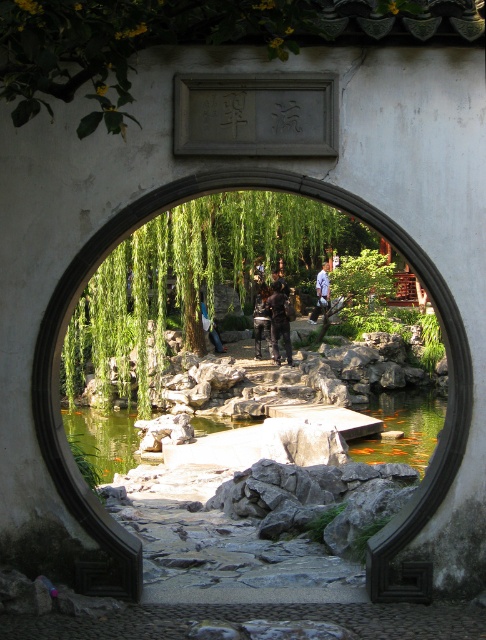
Which is more to the left, stone at center or dark brown leather jacket at center?

stone at center is more to the left.

Between stone at center and dark brown leather jacket at center, which one has less height?

dark brown leather jacket at center

Is point (429, 492) farther from viewer compared to point (271, 316)?

No.

You are a GUI agent. You are given a task and a screenshot of the screen. Output one action in this format:
    pyautogui.click(x=<x>, y=<y>)
    Task: Click on the stone at center
    The image size is (486, 640).
    Given the screenshot: What is the action you would take?
    pyautogui.click(x=435, y=449)

Is stone at center to the left of green stone pond at center from the viewer's perspective?

In fact, stone at center is to the right of green stone pond at center.

Which is in front, point (50, 316) or point (399, 392)?

Point (50, 316)

Where is `stone at center`? Image resolution: width=486 pixels, height=640 pixels. stone at center is located at coordinates (435, 449).

Does dark brown leather jacket at center appear over dark blue uniform at center?

No, dark brown leather jacket at center is not above dark blue uniform at center.

Which is more to the left, dark brown leather jacket at center or dark blue uniform at center?

dark brown leather jacket at center is more to the left.

Between point (277, 284) and point (276, 273), which one is positioned behind?

Point (276, 273)

Find the location of a particular element. The height and width of the screenshot is (640, 486). dark brown leather jacket at center is located at coordinates (279, 321).